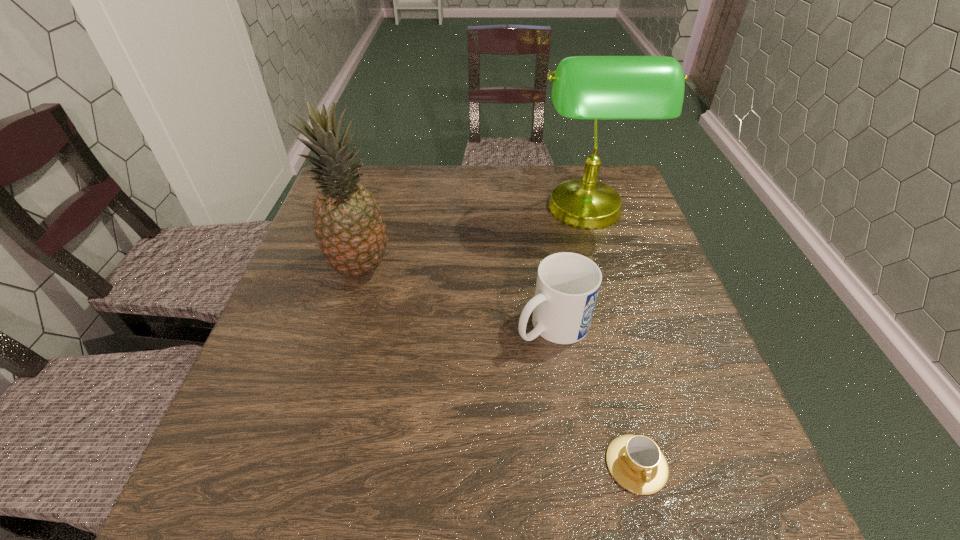
In order to click on free spot at the near edge of the desktop in this screenshot , I will do `click(521, 476)`.

The width and height of the screenshot is (960, 540). In the image, there is a desktop. In order to click on vacant space at the left edge in this screenshot , I will do `click(312, 283)`.

You are a GUI agent. You are given a task and a screenshot of the screen. Output one action in this format:
    pyautogui.click(x=<x>, y=<y>)
    Task: Click on the vacant area at the right edge of the desktop
    
    Given the screenshot: What is the action you would take?
    pyautogui.click(x=634, y=302)

In the image, there is a desktop. Identify the location of vacant region at the far left corner. (377, 177).

Locate an element on the screen. vacant space at the far right corner is located at coordinates (627, 192).

In order to click on free space that is in between the farthest object and the nearest object in this screenshot , I will do `click(612, 338)`.

Locate an element on the screen. The width and height of the screenshot is (960, 540). free space between the nearest object and the farthest object is located at coordinates (612, 338).

What are the coordinates of `vacant area between the shortest object and the lamp` in the screenshot? It's located at (612, 338).

I want to click on free point between the nearest object and the lamp, so click(612, 338).

At what (x,y) coordinates should I click in order to perform the action: click on vacant space that's between the shortest object and the mug. Please return your answer as a coordinate pair (x, y). Image resolution: width=960 pixels, height=540 pixels. Looking at the image, I should click on (594, 395).